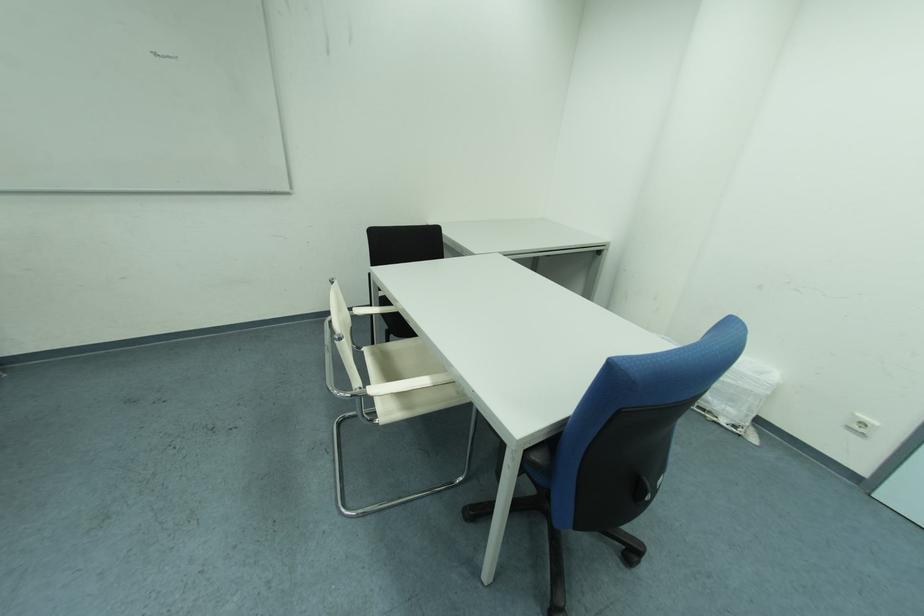
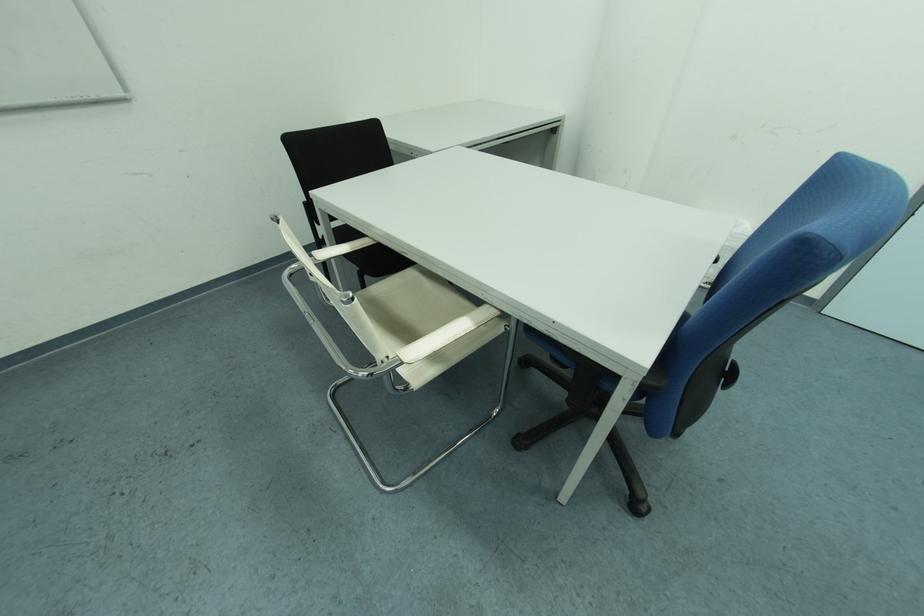
Locate, in the second image, the point that corresponds to (369,313) in the first image.

(331, 257)